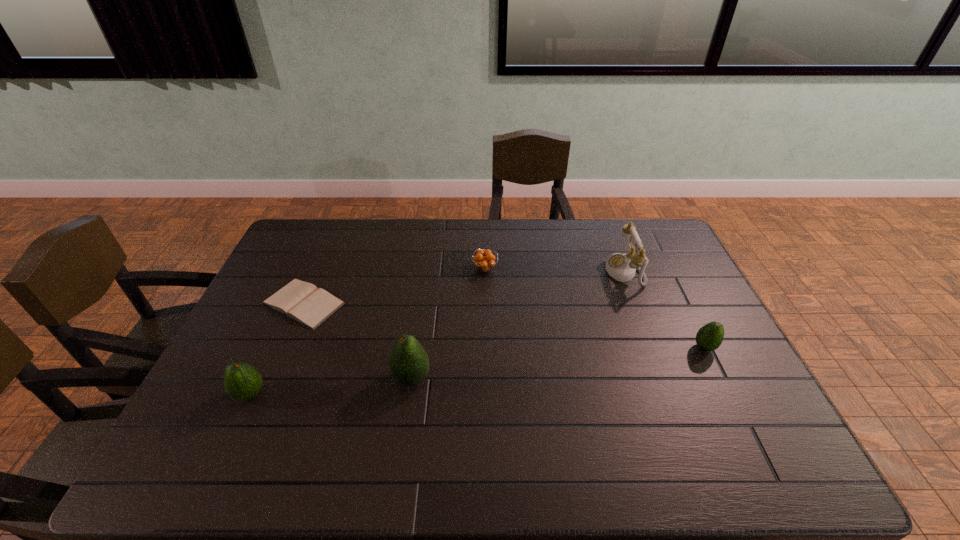
Please point a space for a new avocado to maintain equal intervals. Please provide its 2D coordinates. Your answer should be formatted as a tuple, i.e. [(x, y)], where the tuple contains the x and y coordinates of a point satisfying the conditions above.

[(563, 362)]